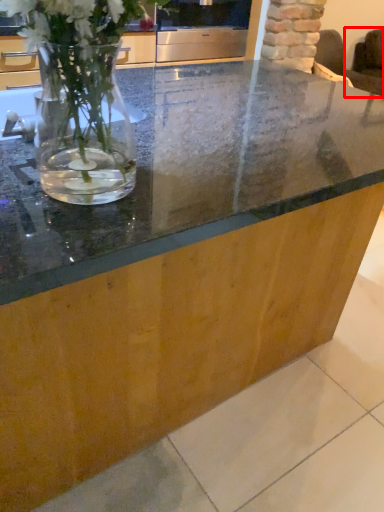
Question: In this image, where is armchair (annotated by the red box) located relative to appliance?

Choices:
 (A) right
 (B) left

Answer: (A)